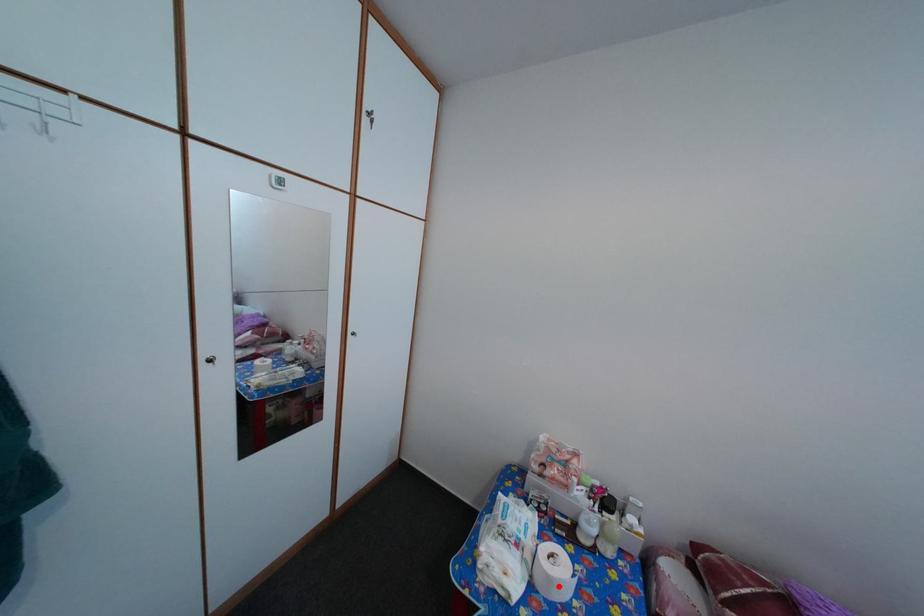
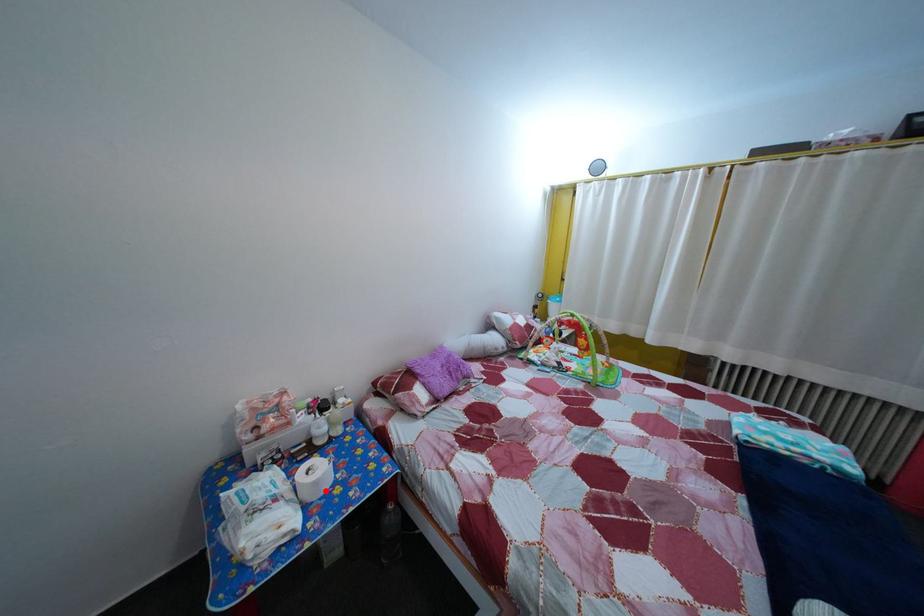
I am providing you with two images of the same scene from different viewpoints. A red point is marked on the first image and another point is marked on the second image. Are the points marked in image1 and image2 representing the same 3D position?

Yes